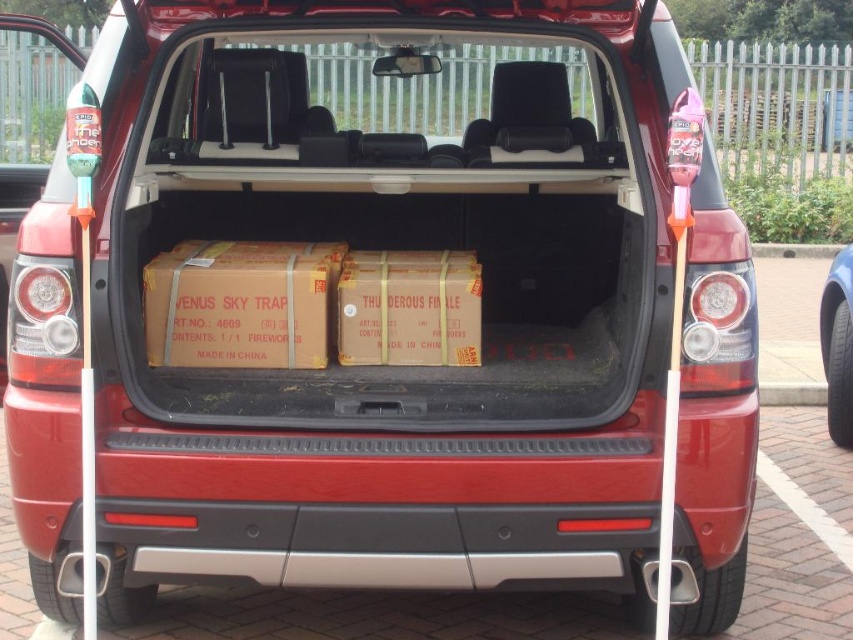
Question: Is brown cardboard box at center further to camera compared to black rubber tire at lower right?

Choices:
 (A) no
 (B) yes

Answer: (A)

Question: Considering the relative positions of brown cardboard box at center and black rubber tire at lower right in the image provided, where is brown cardboard box at center located with respect to black rubber tire at lower right?

Choices:
 (A) below
 (B) above

Answer: (B)

Question: Which object is closer to the camera taking this photo?

Choices:
 (A) black rubber tire at lower right
 (B) brown cardboard box at center

Answer: (B)

Question: Can you confirm if brown cardboard box at center is bigger than black rubber tire at lower right?

Choices:
 (A) no
 (B) yes

Answer: (A)